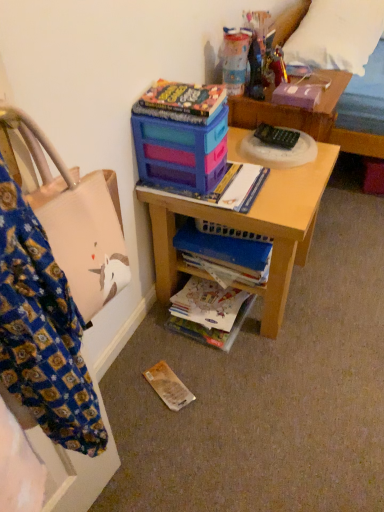
This screenshot has width=384, height=512. Find the location of `vacant space positioned to the left of brown paper book at lower center, the third paperback book positioned from the right`. vacant space positioned to the left of brown paper book at lower center, the third paperback book positioned from the right is located at coordinates (125, 387).